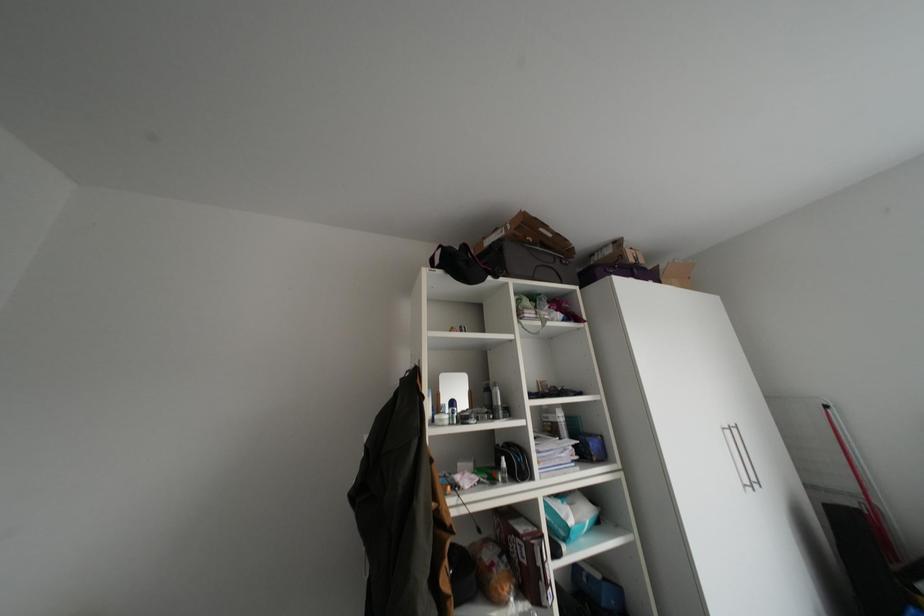
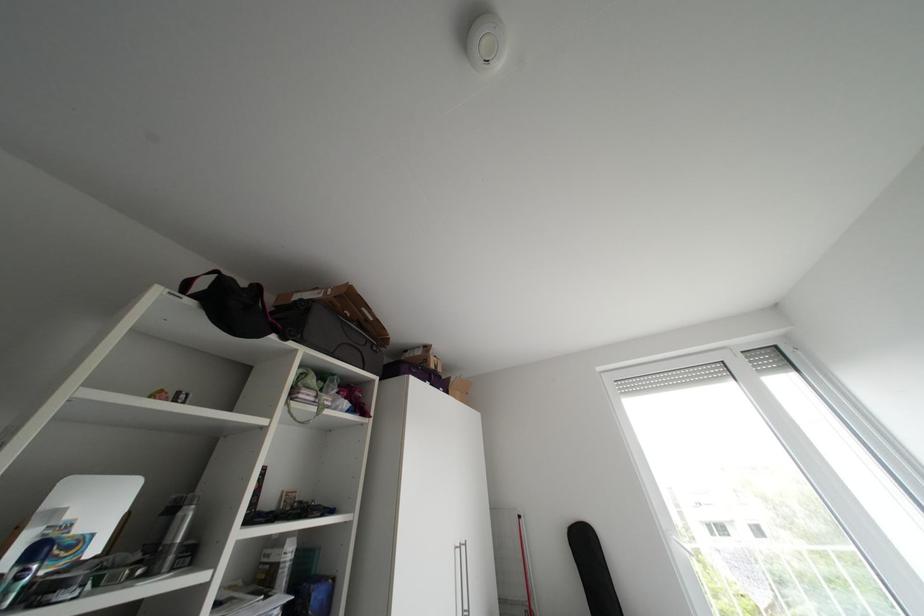
Based on the continuous images, in which direction is the camera rotating?

The rotation direction of the camera is right-up.